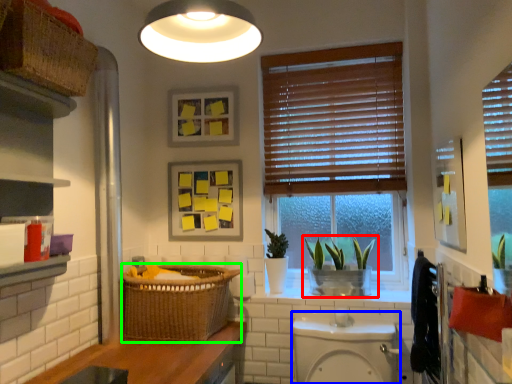
Question: Based on their relative distances, which object is farther from houseplant (highlighted by a red box)? Choose from toilet bowl (highlighted by a blue box) and basket (highlighted by a green box).

Choices:
 (A) toilet bowl
 (B) basket

Answer: (B)